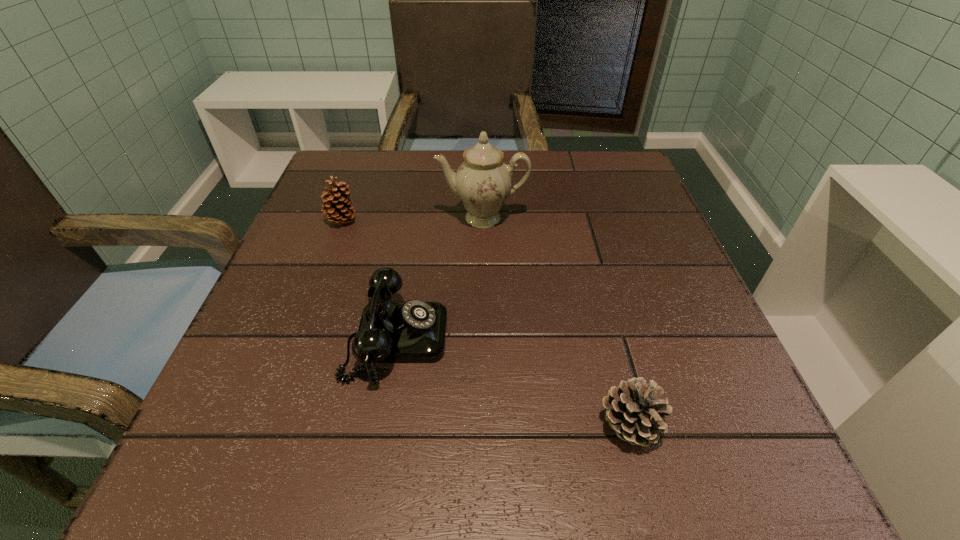
Find the location of a particular element. The height and width of the screenshot is (540, 960). blank space at the far right corner of the desktop is located at coordinates click(x=651, y=195).

Find the location of a particular element. This screenshot has width=960, height=540. unoccupied position between the tallest object and the left pinecone is located at coordinates (412, 220).

At what (x,y) coordinates should I click in order to perform the action: click on vacant point located between the chinaware and the leftmost object. Please return your answer as a coordinate pair (x, y). The image size is (960, 540). Looking at the image, I should click on (412, 220).

Identify the location of free space between the chinaware and the shorter pinecone. The height and width of the screenshot is (540, 960). (556, 322).

You are a GUI agent. You are given a task and a screenshot of the screen. Output one action in this format:
    pyautogui.click(x=<x>, y=<y>)
    Task: Click on the free space that is in between the telephone and the tallest object
    The image size is (960, 540).
    Given the screenshot: What is the action you would take?
    pyautogui.click(x=440, y=278)

The width and height of the screenshot is (960, 540). In order to click on empty space that is in between the chinaware and the left pinecone in this screenshot , I will do `click(412, 220)`.

Where is `unoccupied position between the rightmost object and the second nearest object`? unoccupied position between the rightmost object and the second nearest object is located at coordinates (513, 382).

I want to click on empty space between the tallest object and the second nearest object, so click(440, 278).

I want to click on free point between the farther pinecone and the right pinecone, so point(486,323).

Where is `free space between the taller pinecone and the right pinecone`? free space between the taller pinecone and the right pinecone is located at coordinates (486, 323).